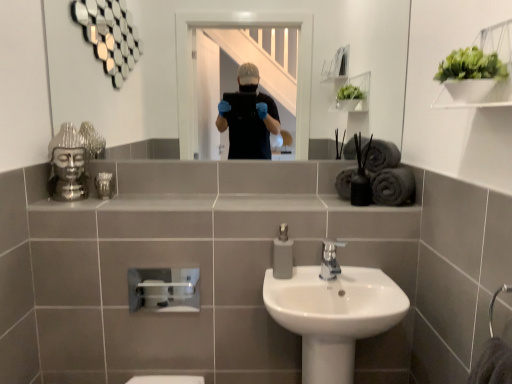
You are a GUI agent. You are given a task and a screenshot of the screen. Output one action in this format:
    pyautogui.click(x=<x>, y=<y>)
    Task: Click on the free location to the left of metallic glass at upper left
    The image size is (512, 384).
    Given the screenshot: What is the action you would take?
    pyautogui.click(x=68, y=194)